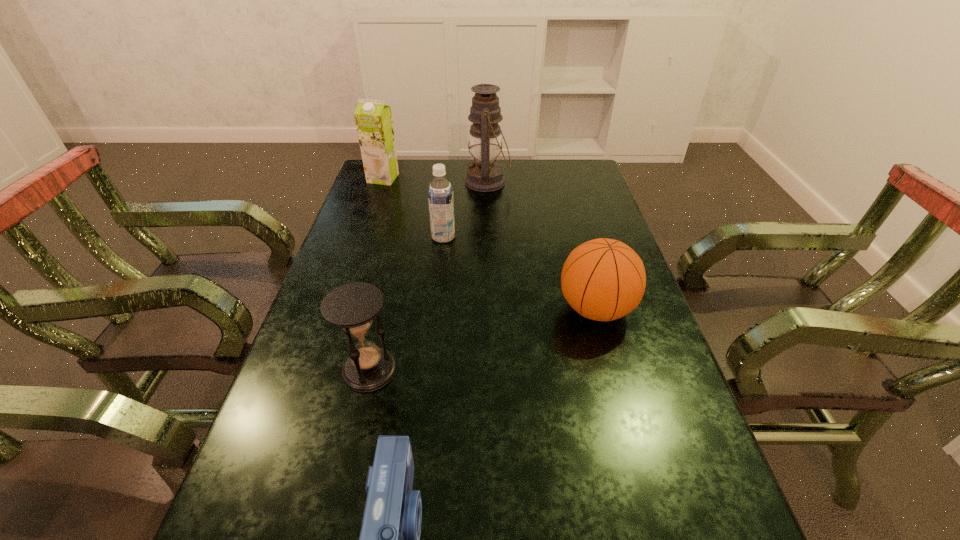
At what (x,y) coordinates should I click in order to perform the action: click on oil lamp. Please return your answer as a coordinate pair (x, y). The image size is (960, 540). Looking at the image, I should click on (485, 175).

Identify the location of the second object from right to left. The width and height of the screenshot is (960, 540). (485, 175).

This screenshot has width=960, height=540. Identify the location of the second tallest object. (373, 118).

Locate an element on the screen. This screenshot has width=960, height=540. the farther soya milk is located at coordinates (373, 118).

This screenshot has width=960, height=540. In order to click on the shorter soya milk in this screenshot , I will do `click(440, 192)`.

The height and width of the screenshot is (540, 960). Find the location of `the right soya milk`. the right soya milk is located at coordinates (440, 192).

Where is `hourglass`? The width and height of the screenshot is (960, 540). hourglass is located at coordinates (353, 306).

Locate an element on the screen. The height and width of the screenshot is (540, 960). the rightmost object is located at coordinates (603, 279).

The height and width of the screenshot is (540, 960). In order to click on basketball in this screenshot , I will do `click(603, 279)`.

Identify the location of vacant space located 0.210m on the front of the oil lamp. This screenshot has width=960, height=540. (489, 234).